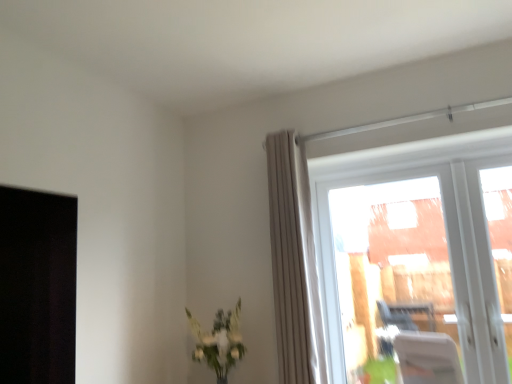
Question: Does beige textured curtain at upper right have a greater height compared to green leafy plant at lower center?

Choices:
 (A) yes
 (B) no

Answer: (A)

Question: Does beige textured curtain at upper right have a larger size compared to green leafy plant at lower center?

Choices:
 (A) yes
 (B) no

Answer: (A)

Question: From a real-world perspective, is beige textured curtain at upper right physically above green leafy plant at lower center?

Choices:
 (A) no
 (B) yes

Answer: (B)

Question: Does beige textured curtain at upper right have a lesser height compared to green leafy plant at lower center?

Choices:
 (A) yes
 (B) no

Answer: (B)

Question: From the image's perspective, is beige textured curtain at upper right located above green leafy plant at lower center?

Choices:
 (A) yes
 (B) no

Answer: (A)

Question: Would you consider beige textured curtain at upper right to be distant from green leafy plant at lower center?

Choices:
 (A) yes
 (B) no

Answer: (B)

Question: Is transparent glass window at upper right facing away from green leafy plant at lower center?

Choices:
 (A) no
 (B) yes

Answer: (A)

Question: Is transparent glass window at upper right facing towards green leafy plant at lower center?

Choices:
 (A) no
 (B) yes

Answer: (A)

Question: Does transparent glass window at upper right appear on the right side of green leafy plant at lower center?

Choices:
 (A) no
 (B) yes

Answer: (B)

Question: Is the surface of transparent glass window at upper right in direct contact with green leafy plant at lower center?

Choices:
 (A) no
 (B) yes

Answer: (A)

Question: From the image's perspective, is transparent glass window at upper right located beneath green leafy plant at lower center?

Choices:
 (A) yes
 (B) no

Answer: (B)

Question: Is transparent glass window at upper right bigger than green leafy plant at lower center?

Choices:
 (A) no
 (B) yes

Answer: (B)

Question: From the image's perspective, is green leafy plant at lower center on top of beige textured curtain at upper right?

Choices:
 (A) yes
 (B) no

Answer: (B)